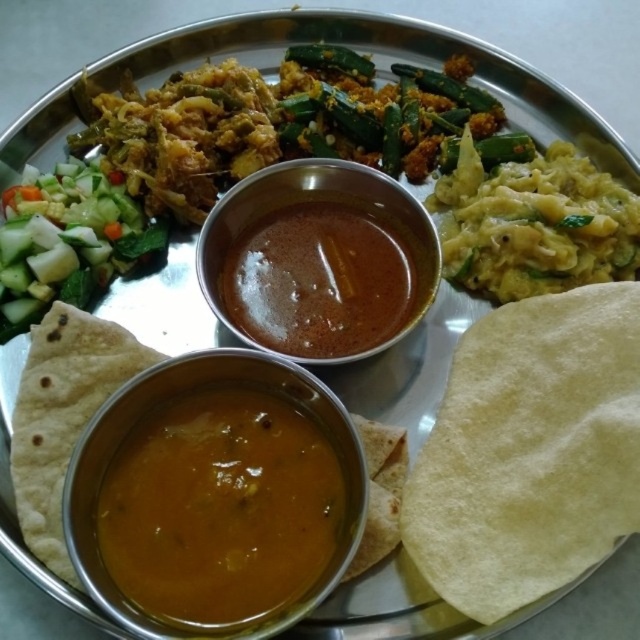
Between brown creamy sauce at center and brown thick sauce at center, which one has more height?

brown creamy sauce at center

Where is `brown creamy sauce at center`? brown creamy sauce at center is located at coordinates click(x=220, y=508).

Does yellow soft tortilla at lower right have a greater width compared to brown creamy sauce at center?

Indeed, yellow soft tortilla at lower right has a greater width compared to brown creamy sauce at center.

Is yellow soft tortilla at lower right positioned behind brown creamy sauce at center?

Yes, yellow soft tortilla at lower right is behind brown creamy sauce at center.

Locate an element on the screen. The width and height of the screenshot is (640, 640). yellow soft tortilla at lower right is located at coordinates (529, 451).

Does yellow soft tortilla at lower right appear on the right side of brown thick sauce at center?

Correct, you'll find yellow soft tortilla at lower right to the right of brown thick sauce at center.

Can you confirm if yellow soft tortilla at lower right is positioned below brown thick sauce at center?

Correct, yellow soft tortilla at lower right is located below brown thick sauce at center.

Describe the element at coordinates (529, 451) in the screenshot. I see `yellow soft tortilla at lower right` at that location.

Where is `yellow soft tortilla at lower right`? This screenshot has height=640, width=640. yellow soft tortilla at lower right is located at coordinates (529, 451).